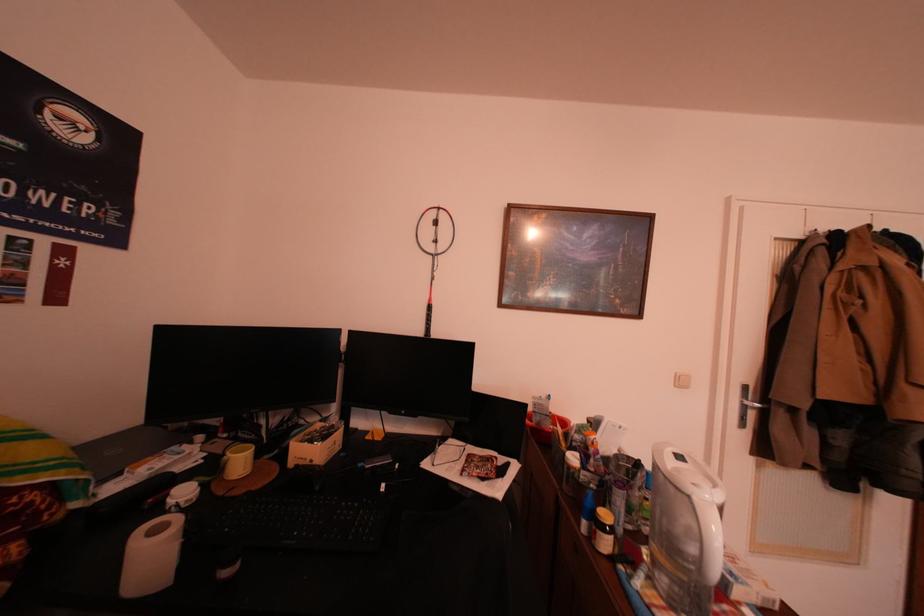
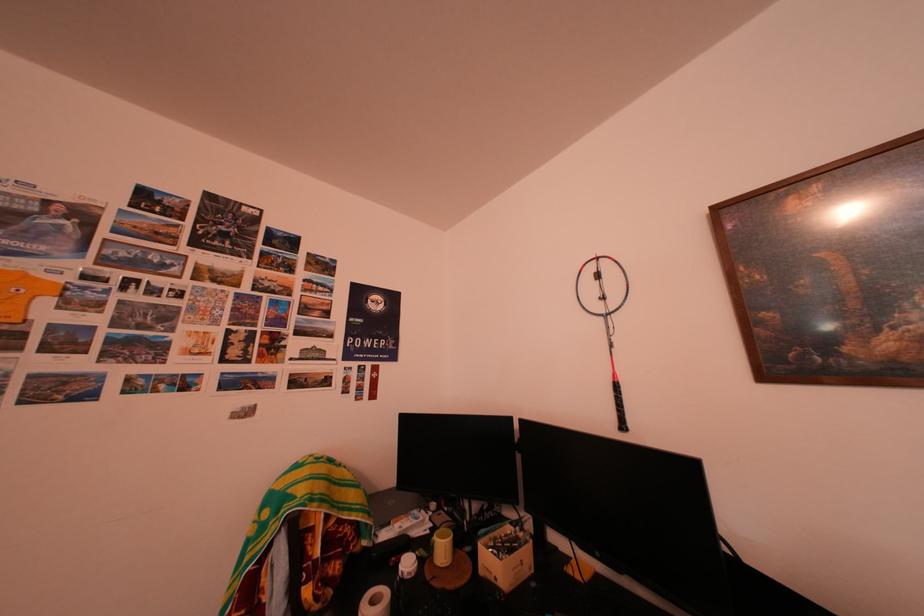
Locate, in the second image, the point that corresponds to point 213,467 in the first image.

(441, 537)